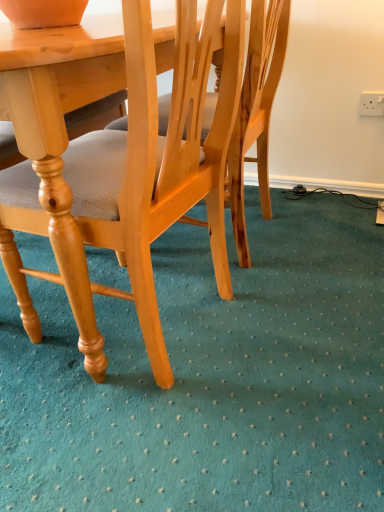
The image size is (384, 512). What do you see at coordinates (371, 103) in the screenshot?
I see `white plastic power outlet at upper right` at bounding box center [371, 103].

What is the approximate height of white plastic power outlet at upper right?

white plastic power outlet at upper right is 4.50 inches in height.

Image resolution: width=384 pixels, height=512 pixels. I want to click on white plastic power outlet at upper right, so click(371, 103).

Image resolution: width=384 pixels, height=512 pixels. What do you see at coordinates (122, 176) in the screenshot?
I see `light wood chair at center` at bounding box center [122, 176].

You are a GUI agent. You are given a task and a screenshot of the screen. Output one action in this format:
    pyautogui.click(x=<x>, y=<y>)
    Task: Click on the light wood chair at center
    
    Given the screenshot: What is the action you would take?
    pyautogui.click(x=122, y=176)

This screenshot has width=384, height=512. In order to click on white plastic power outlet at upper right in this screenshot , I will do `click(371, 103)`.

Is white plastic power outlet at upper right to the right of light wood chair at center from the viewer's perspective?

Correct, you'll find white plastic power outlet at upper right to the right of light wood chair at center.

In the image, is white plastic power outlet at upper right positioned in front of or behind light wood chair at center?

white plastic power outlet at upper right is behind light wood chair at center.

Between point (367, 103) and point (107, 149), which one is positioned in front?

The point (107, 149) is more forward.

From the image's perspective, is white plastic power outlet at upper right over light wood chair at center?

Yes.

From a real-world perspective, between white plastic power outlet at upper right and light wood chair at center, who is vertically higher?

In real-world perspective, light wood chair at center is above.

Between white plastic power outlet at upper right and light wood chair at center, which one has smaller width?

white plastic power outlet at upper right is thinner.

Is white plastic power outlet at upper right taller or shorter than light wood chair at center?

white plastic power outlet at upper right is shorter than light wood chair at center.

Considering the relative sizes of white plastic power outlet at upper right and light wood chair at center in the image provided, is white plastic power outlet at upper right bigger than light wood chair at center?

No.

From the picture: Choose the correct answer: Is white plastic power outlet at upper right inside light wood chair at center or outside it?

white plastic power outlet at upper right is not inside light wood chair at center, it's outside.

Are white plastic power outlet at upper right and light wood chair at center making contact?

No, white plastic power outlet at upper right is not beside light wood chair at center.

Is white plastic power outlet at upper right turned away from light wood chair at center?

No, light wood chair at center is not at the back of white plastic power outlet at upper right.

How many degrees apart are the facing directions of white plastic power outlet at upper right and light wood chair at center?

There is a 88.4-degree angle between the facing directions of white plastic power outlet at upper right and light wood chair at center.

Locate an element on the screen. power outlet on the right side of light wood chair at center is located at coordinates (371, 103).

Which object is positioned more to the left, light wood chair at center or white plastic power outlet at upper right?

Positioned to the left is light wood chair at center.

Is light wood chair at center behind white plastic power outlet at upper right?

No, light wood chair at center is closer to the camera.

Which is closer, (x=159, y=209) or (x=365, y=100)?

Positioned in front is point (x=159, y=209).

From the image's perspective, is light wood chair at center located above white plastic power outlet at upper right?

Incorrect, from the image's perspective, light wood chair at center is lower than white plastic power outlet at upper right.

From a real-world perspective, which object rests below the other?

white plastic power outlet at upper right, from a real-world perspective.

Considering the relative sizes of light wood chair at center and white plastic power outlet at upper right in the image provided, is light wood chair at center wider than white plastic power outlet at upper right?

Yes.

Between light wood chair at center and white plastic power outlet at upper right, which one has less height?

Standing shorter between the two is white plastic power outlet at upper right.

Looking at the image, does light wood chair at center seem bigger or smaller compared to white plastic power outlet at upper right?

Considering their sizes, light wood chair at center takes up more space than white plastic power outlet at upper right.

Is light wood chair at center located outside white plastic power outlet at upper right?

That's correct, light wood chair at center is outside of white plastic power outlet at upper right.

Is light wood chair at center in contact with white plastic power outlet at upper right?

No.

Is light wood chair at center turned away from white plastic power outlet at upper right?

No, white plastic power outlet at upper right is not at the back of light wood chair at center.

How different are the orientations of light wood chair at center and white plastic power outlet at upper right in degrees?

88.4 degrees separate the facing orientations of light wood chair at center and white plastic power outlet at upper right.

How far apart are light wood chair at center and white plastic power outlet at upper right?

light wood chair at center is 3.86 feet away from white plastic power outlet at upper right.

At what (x,y) coordinates should I click in order to perform the action: click on power outlet on the right of the light wood chair at center. Please return your answer as a coordinate pair (x, y). Image resolution: width=384 pixels, height=512 pixels. Looking at the image, I should click on (371, 103).

What are the coordinates of `chair located above the white plastic power outlet at upper right (from a real-world perspective)` in the screenshot? It's located at (122, 176).

Locate an element on the screen. The height and width of the screenshot is (512, 384). chair below the white plastic power outlet at upper right (from the image's perspective) is located at coordinates (122, 176).